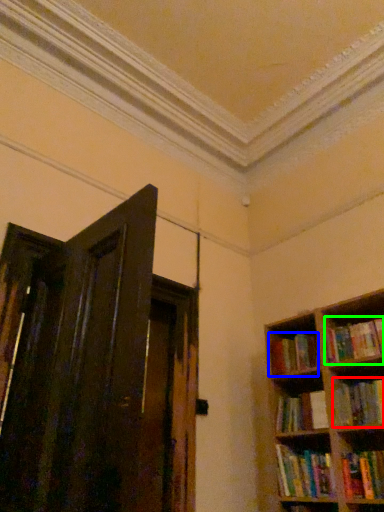
Question: Considering the real-world distances, which object is closest to book (highlighted by a red box)? book (highlighted by a blue box) or book (highlighted by a green box).

Choices:
 (A) book
 (B) book

Answer: (B)